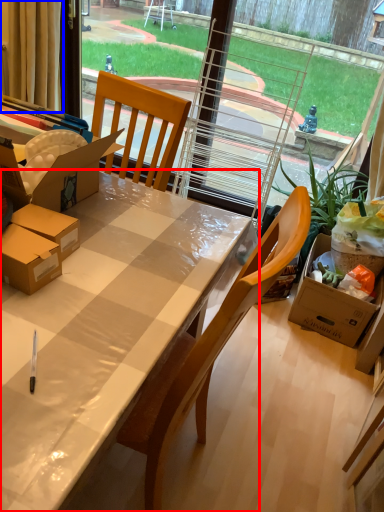
Question: Which object appears closest to the camera in this image, desk (highlighted by a red box) or curtain (highlighted by a blue box)?

Choices:
 (A) desk
 (B) curtain

Answer: (A)